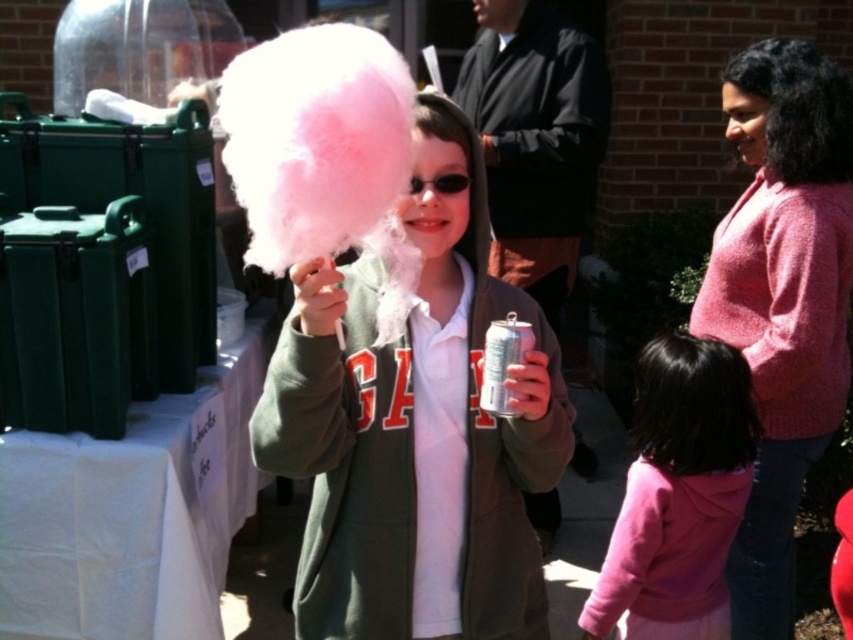
What is located at the coordinates point [415,426] in the image?

The point [415,426] marks the location of the pink fluffy cotton candy at center.

You are a photographer at the event and want to capture a photo of the pink fluffy cotton candy at center and the pink fleece jacket at lower right. However, you notice that one object is blocking the view of the other. Which object is covering the other?

The pink fluffy cotton candy at center is positioned over the pink fleece jacket at lower right, so the cotton candy is covering the jacket.